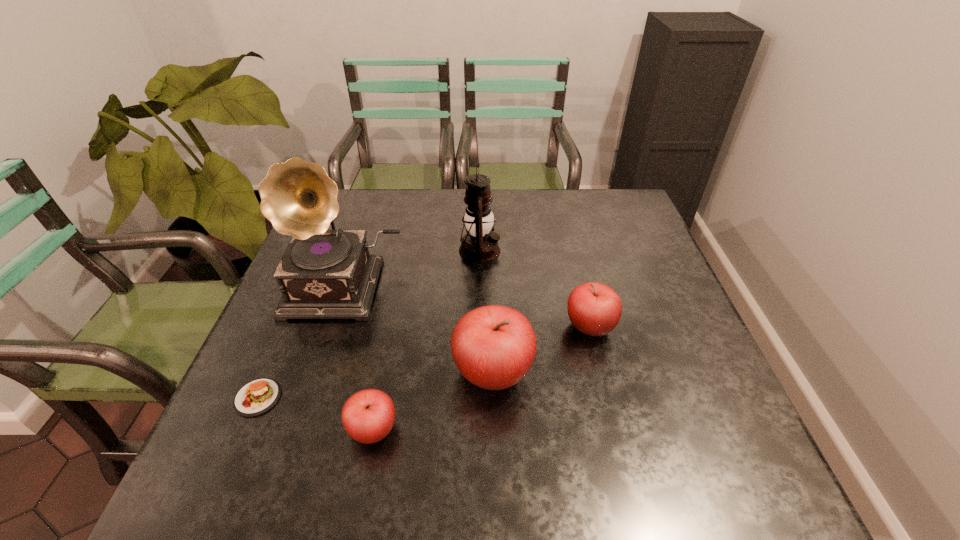
The image size is (960, 540). In order to click on the shortest apple in this screenshot , I will do `click(368, 416)`.

Locate an element on the screen. the leftmost apple is located at coordinates (368, 416).

Identify the location of the second apple from left to right. The image size is (960, 540). (493, 347).

Where is `the third tallest object`? The width and height of the screenshot is (960, 540). the third tallest object is located at coordinates (493, 347).

This screenshot has width=960, height=540. I want to click on the second tallest apple, so click(x=594, y=309).

I want to click on the rightmost object, so click(594, 309).

Where is `the tallest object`? The height and width of the screenshot is (540, 960). the tallest object is located at coordinates (323, 274).

Identify the location of the fifth shortest object. The width and height of the screenshot is (960, 540). (480, 245).

This screenshot has height=540, width=960. In order to click on patty (food) in this screenshot , I will do `click(256, 397)`.

The image size is (960, 540). What are the coordinates of `free space located 0.060m on the back of the shortest apple` in the screenshot? It's located at (382, 383).